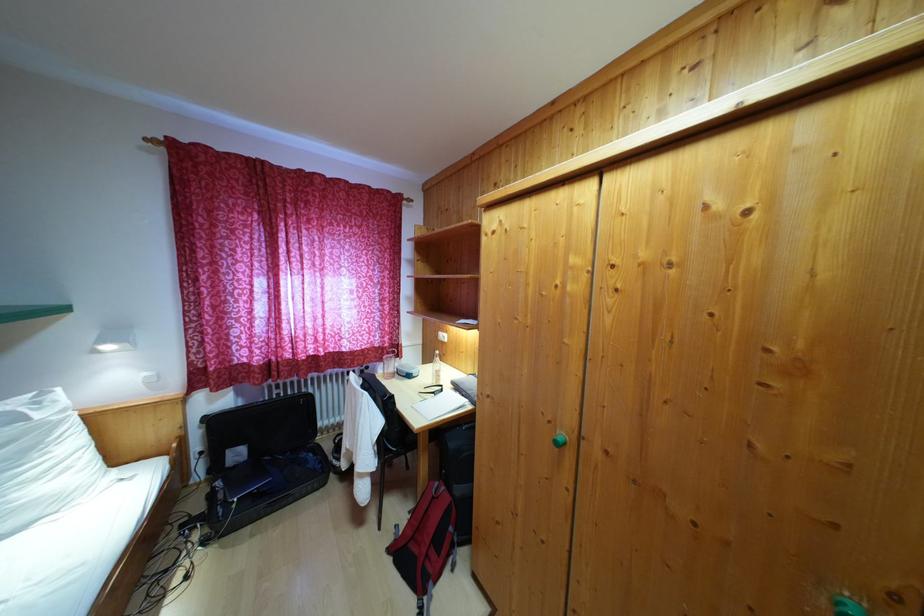
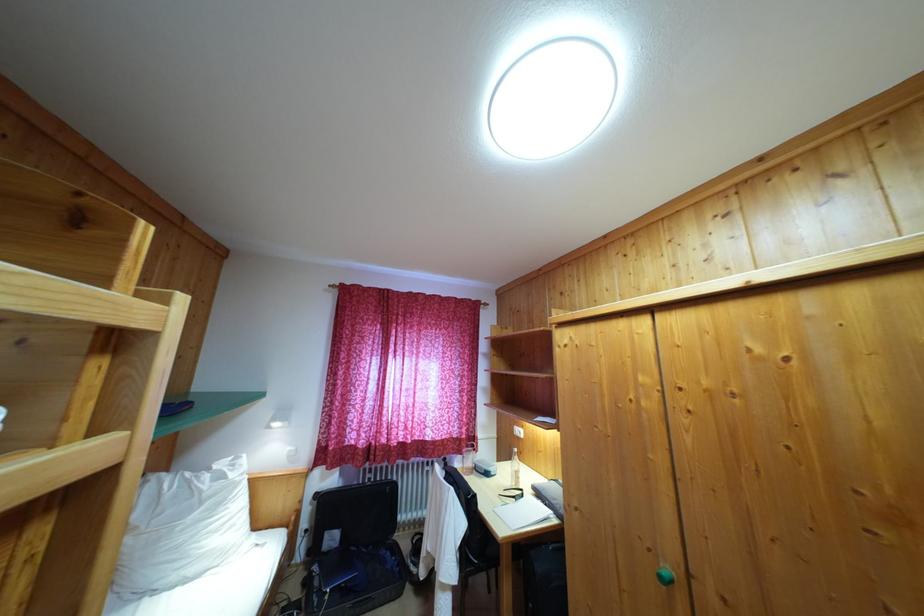
Find the pixel in the second image that matches the point at 406,379 in the first image.

(483, 475)